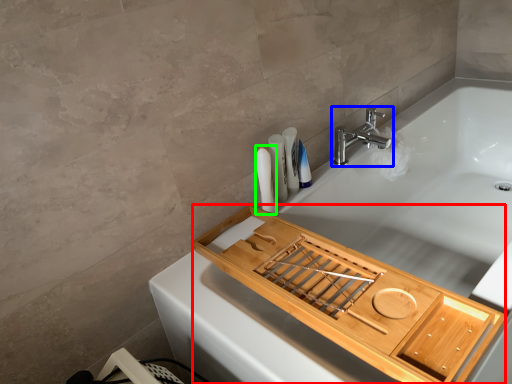
Question: Estimate the real-world distances between objects in this image. Which object is closer to tray (highlighted by a red box), tap (highlighted by a blue box) or toiletry (highlighted by a green box)?

Choices:
 (A) tap
 (B) toiletry

Answer: (B)